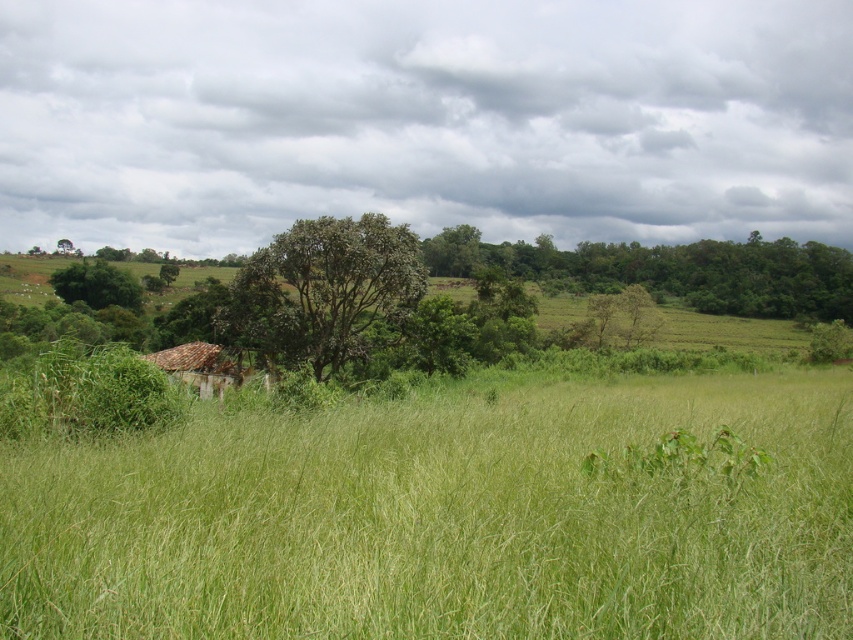
Is green leafy tree at center above green leafy tree at upper left?

No.

Does point (370, 336) come behind point (61, 278)?

No, it is not.

Does point (337, 227) come in front of point (103, 289)?

Yes.

Image resolution: width=853 pixels, height=640 pixels. In order to click on green leafy tree at center in this screenshot , I will do `click(323, 291)`.

Can you confirm if green leafy tree at upper center is shorter than brown tile roof at center?

In fact, green leafy tree at upper center may be taller than brown tile roof at center.

In the scene shown: Between green leafy tree at upper center and brown tile roof at center, which one is positioned lower?

brown tile roof at center is below.

Does point (508, 262) come closer to viewer compared to point (196, 388)?

No.

You are a GUI agent. You are given a task and a screenshot of the screen. Output one action in this format:
    pyautogui.click(x=<x>, y=<y>)
    Task: Click on the green leafy tree at upper center
    This screenshot has height=640, width=853.
    Given the screenshot: What is the action you would take?
    pyautogui.click(x=669, y=269)

Does green grassy field at center have a greater width compared to brown tile roof at center?

Yes, green grassy field at center is wider than brown tile roof at center.

Can you confirm if green grassy field at center is positioned below brown tile roof at center?

Actually, green grassy field at center is above brown tile roof at center.

Is point (703, 602) positioned behind point (186, 360)?

No, (703, 602) is in front of (186, 360).

Where is `green grassy field at center`? The width and height of the screenshot is (853, 640). green grassy field at center is located at coordinates (442, 518).